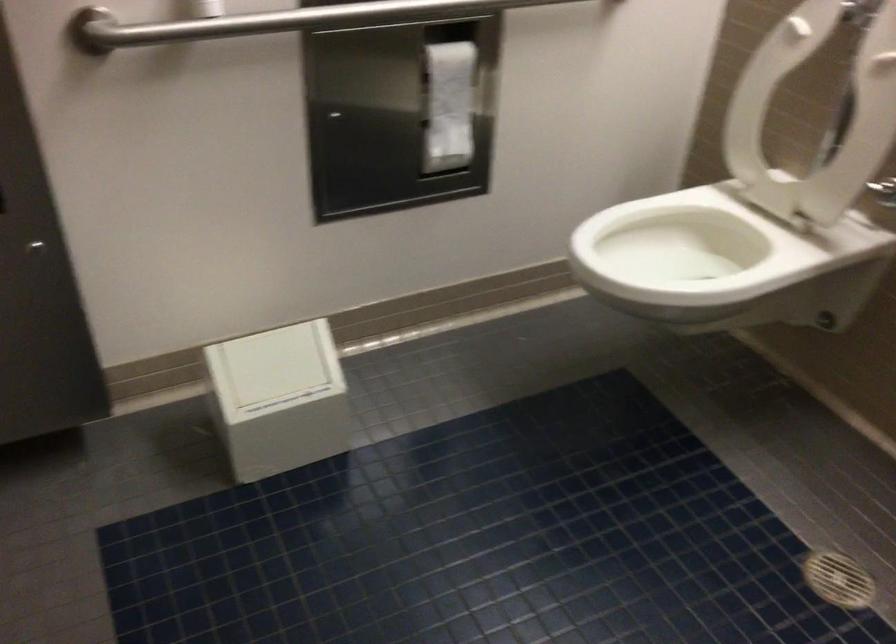
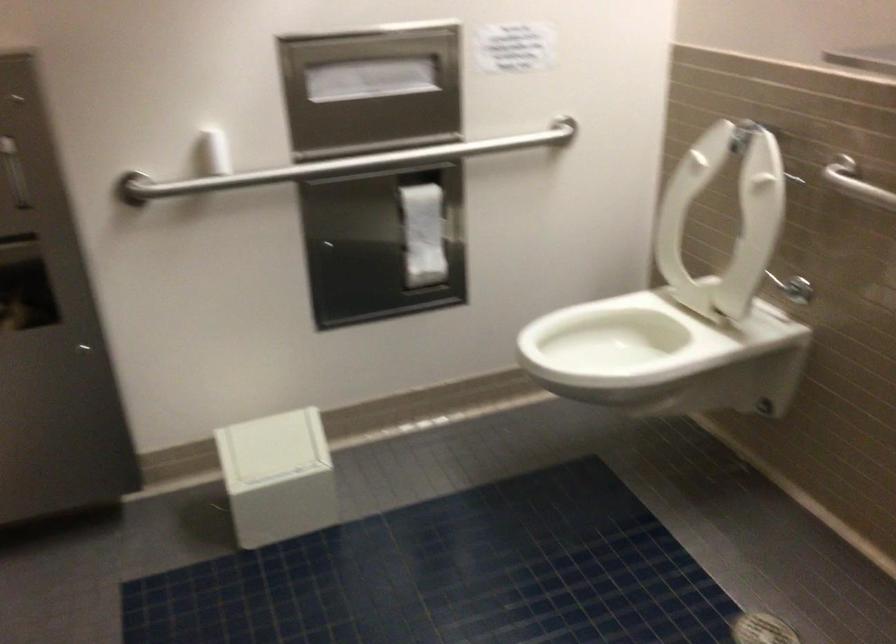
Find the pixel in the second image that matches (446,108) in the first image.

(423, 234)